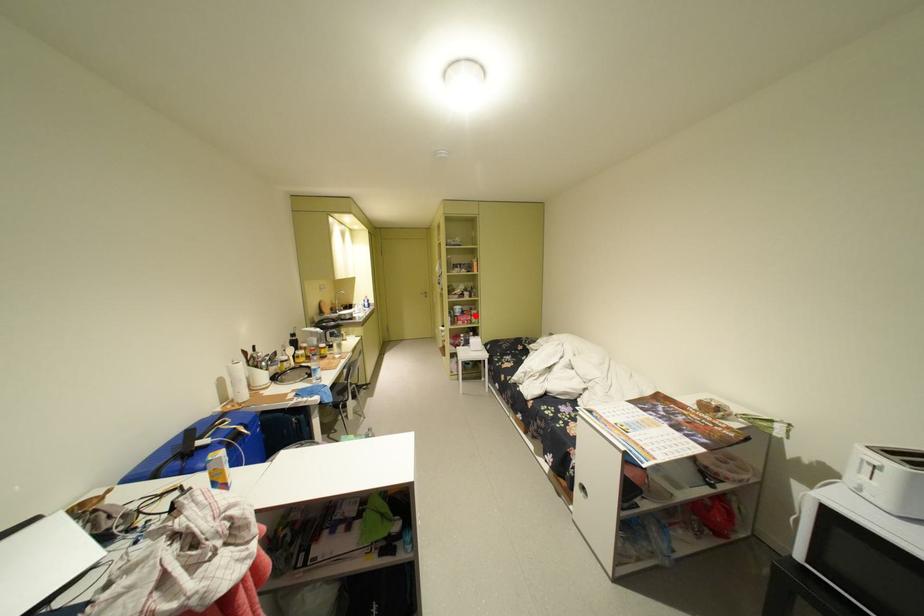
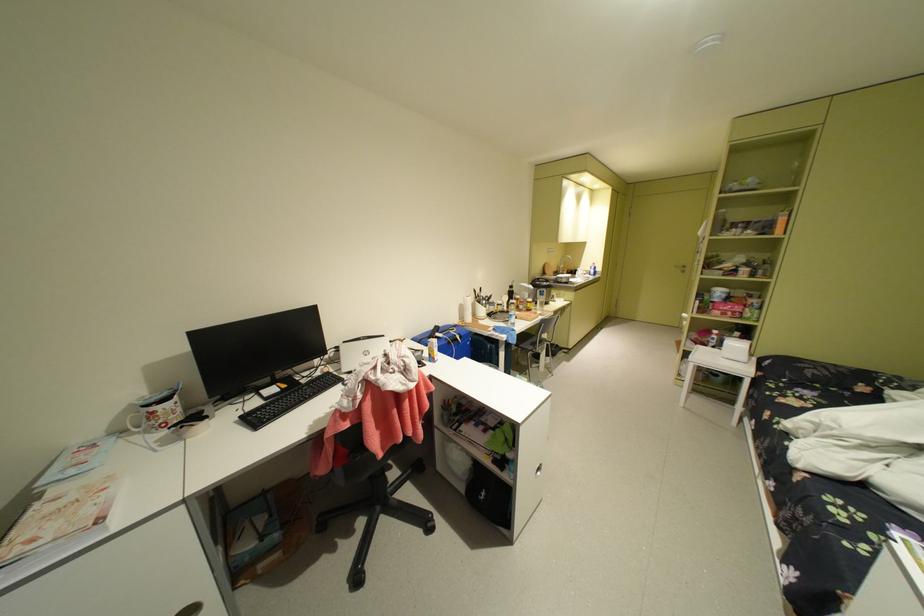
Where in the second image is the point corresponding to the highlighted location from the first image?

(740, 304)